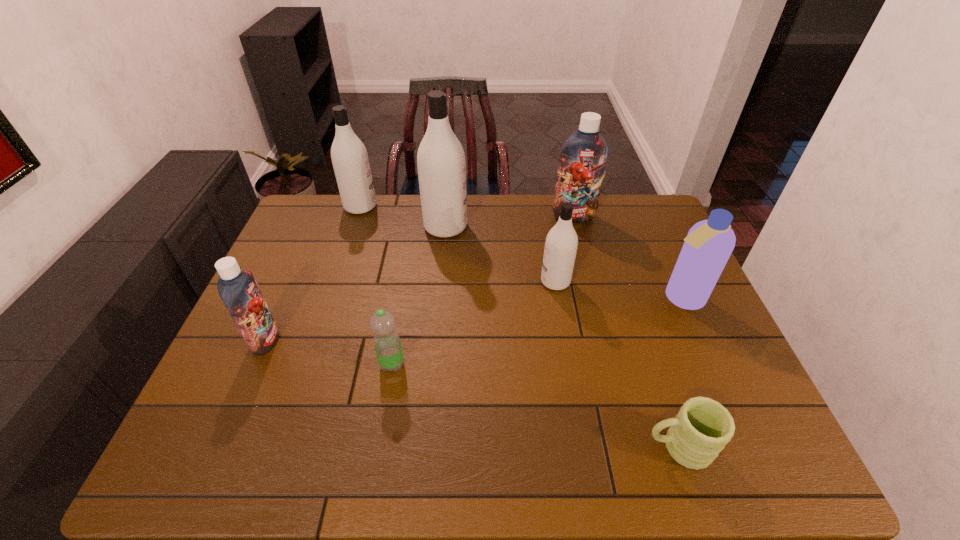
Find the location of a particular element. The image size is (960, 540). the nearest white shampoo is located at coordinates (561, 243).

At what (x,y) coordinates should I click in order to perform the action: click on green water bottle. Please return your answer as a coordinate pair (x, y). Looking at the image, I should click on (387, 344).

In order to click on the second shortest object in this screenshot , I will do `click(387, 344)`.

This screenshot has width=960, height=540. I want to click on the nearest object, so click(699, 432).

The image size is (960, 540). In order to click on green mug in this screenshot , I will do `click(699, 432)`.

This screenshot has width=960, height=540. Find the location of `vacant space located on the front-facing side of the tallest shampoo`. vacant space located on the front-facing side of the tallest shampoo is located at coordinates (563, 227).

The height and width of the screenshot is (540, 960). In order to click on free point located 0.160m on the front-facing side of the seventh object from right to left in this screenshot , I will do pyautogui.click(x=422, y=206).

This screenshot has width=960, height=540. What are the coordinates of `vacant space located 0.170m on the front label of the bigger blue shampoo` in the screenshot? It's located at (584, 256).

At what (x,y) coordinates should I click in order to perform the action: click on vacant space located on the front of the rightmost shampoo. Please return your answer as a coordinate pair (x, y). The height and width of the screenshot is (540, 960). Looking at the image, I should click on (702, 346).

You are a GUI agent. You are given a task and a screenshot of the screen. Output one action in this format:
    pyautogui.click(x=<x>, y=<y>)
    Task: Click on the vacant space located 0.230m on the front label of the left blue shampoo
    Image resolution: width=960 pixels, height=540 pixels.
    Given the screenshot: What is the action you would take?
    pyautogui.click(x=367, y=340)